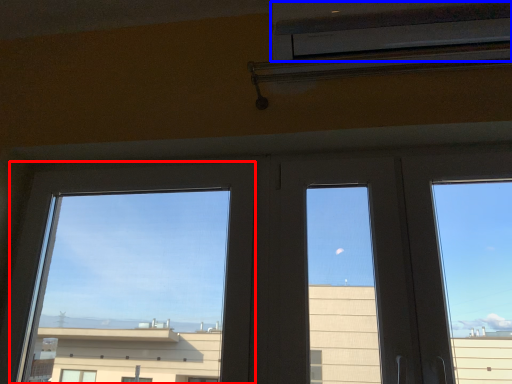
Question: Which object is closer to the camera taking this photo, window (highlighted by a red box) or air conditioning (highlighted by a blue box)?

Choices:
 (A) window
 (B) air conditioning

Answer: (B)